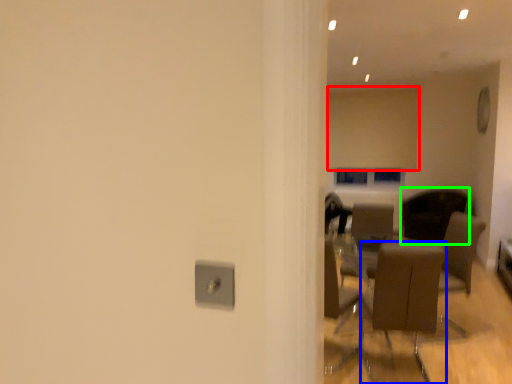
Question: Estimate the real-world distances between objects in this image. Which object is closer to curtain (highlighted by a red box), chair (highlighted by a blue box) or chair (highlighted by a green box)?

Choices:
 (A) chair
 (B) chair

Answer: (B)